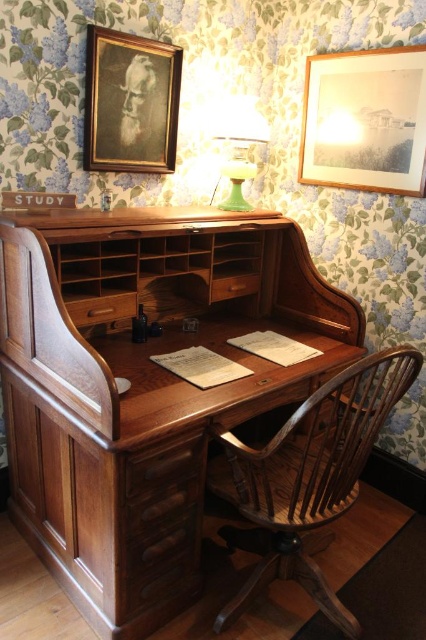
Which is more to the right, wooden chair at center or green glass lamp at upper center?

wooden chair at center

Which is above, wooden chair at center or green glass lamp at upper center?

green glass lamp at upper center

This screenshot has width=426, height=640. Describe the element at coordinates (307, 476) in the screenshot. I see `wooden chair at center` at that location.

I want to click on wooden chair at center, so click(307, 476).

How distant is wooden chair at center from mahogany drawer at center?

The distance of wooden chair at center from mahogany drawer at center is 15.01 inches.

Which of these two, wooden chair at center or mahogany drawer at center, stands shorter?

mahogany drawer at center is shorter.

This screenshot has width=426, height=640. I want to click on wooden chair at center, so click(x=307, y=476).

Is polished wood writing desk at center taller than wooden chair at center?

Yes, polished wood writing desk at center is taller than wooden chair at center.

Does polished wood writing desk at center appear on the right side of wooden chair at center?

In fact, polished wood writing desk at center is to the left of wooden chair at center.

Who is more distant from viewer, (78, 339) or (268, 552)?

Point (268, 552)

This screenshot has height=640, width=426. I want to click on polished wood writing desk at center, so click(x=141, y=384).